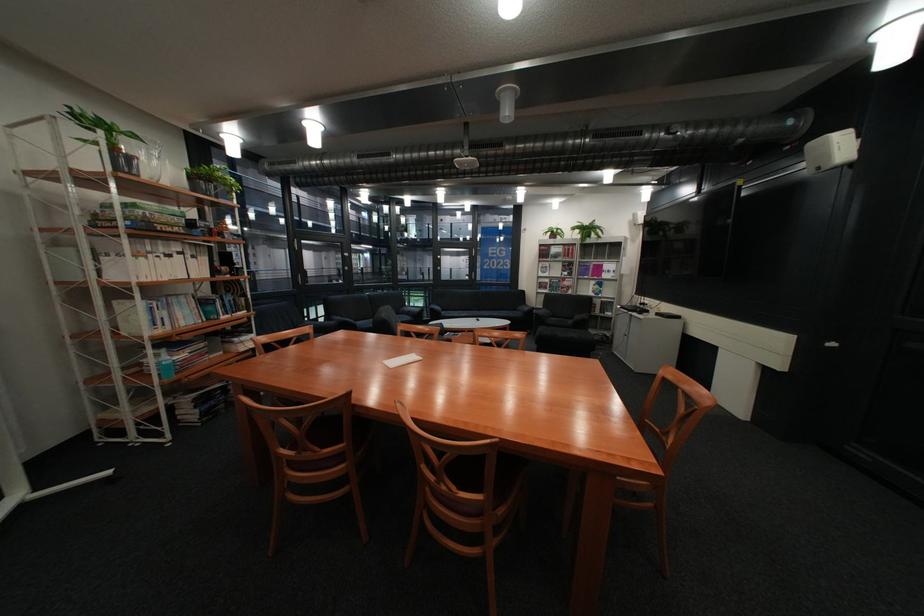
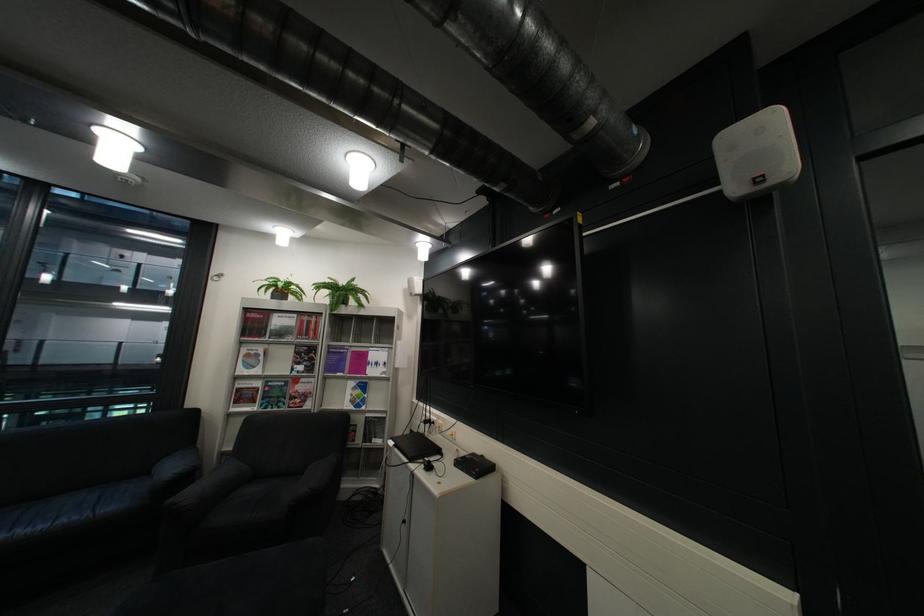
Find the pixel in the second image that matches (x=624, y=314) in the first image.

(393, 442)